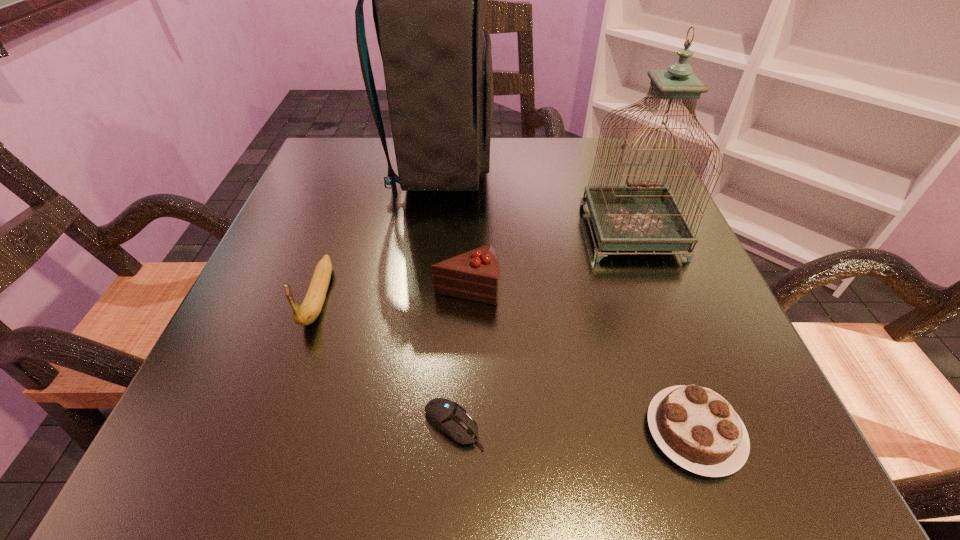
Locate an element on the screen. The width and height of the screenshot is (960, 540). backpack is located at coordinates (429, 0).

You are a GUI agent. You are given a task and a screenshot of the screen. Output one action in this format:
    pyautogui.click(x=<x>, y=<y>)
    Task: Click on the birdcage
    Image resolution: width=960 pixels, height=540 pixels.
    Given the screenshot: What is the action you would take?
    pyautogui.click(x=643, y=216)

Find the location of `the leftmost object`. the leftmost object is located at coordinates (307, 313).

At what (x,y) coordinates should I click in order to perform the action: click on banana. Please return your answer as a coordinate pair (x, y). The image size is (960, 540). Looking at the image, I should click on (307, 313).

Identify the location of the taller chocolate cake. The image size is (960, 540). (475, 275).

In order to click on the fourth tallest object in this screenshot , I will do `click(475, 275)`.

I want to click on the nearer chocolate cake, so click(698, 429).

Where is `the shorter chocolate cake`? The height and width of the screenshot is (540, 960). the shorter chocolate cake is located at coordinates (698, 429).

Where is `computer mouse`? The width and height of the screenshot is (960, 540). computer mouse is located at coordinates (445, 415).

Where is `vacant area situated 0.120m on the front-facing side of the tallest object`? Image resolution: width=960 pixels, height=540 pixels. vacant area situated 0.120m on the front-facing side of the tallest object is located at coordinates (547, 168).